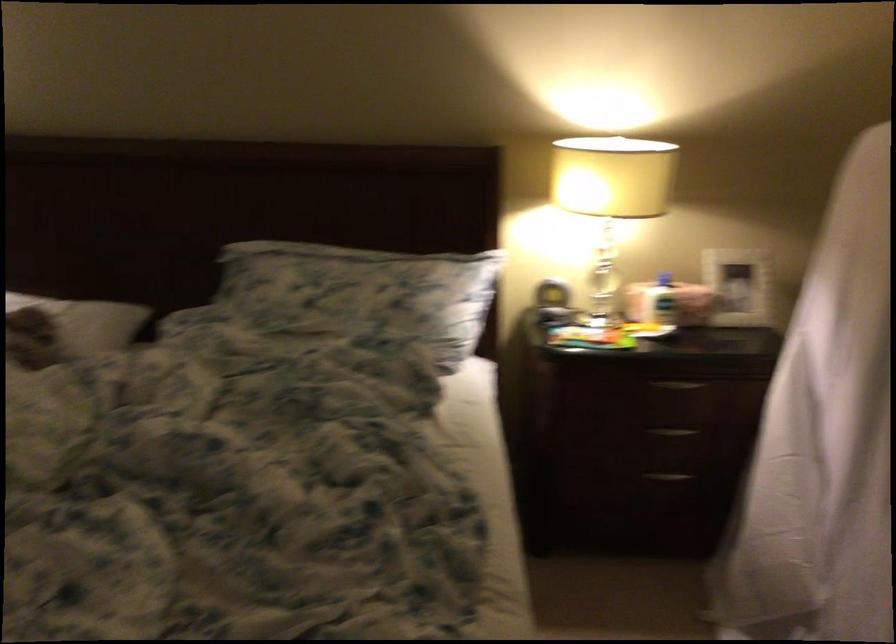
Describe the element at coordinates (664, 279) in the screenshot. I see `a bottle pump dispenser` at that location.